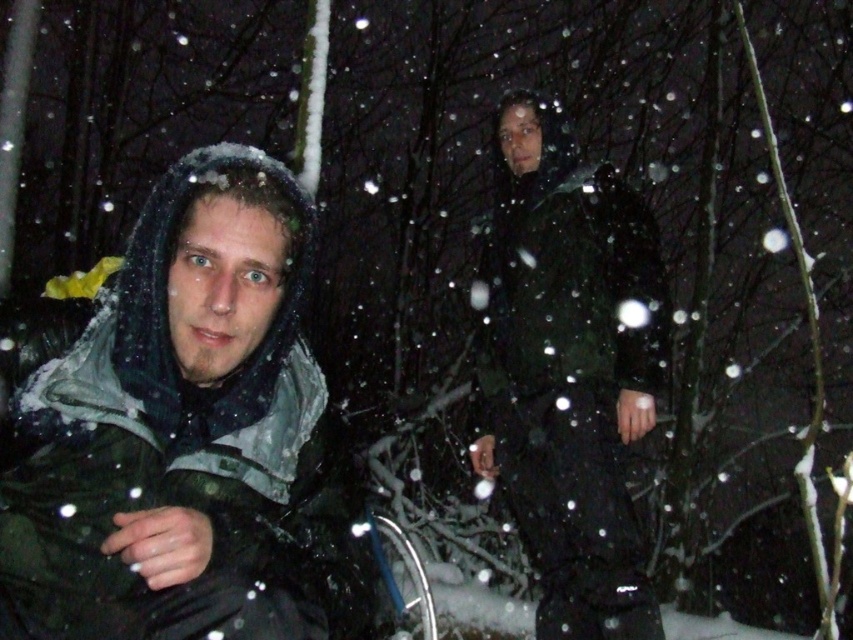
You are a photographer trying to capture the matte black jacket at left in the snowy forest scene. Where exactly should you focus your camera to ensure it is in sharp focus?

You should focus your camera at point (x=189, y=436) to ensure the matte black jacket at left is in sharp focus.

You are a photographer trying to capture a closeup of the snowflakes on the person in the foreground. You have two points marked in the image, point A at coordinates point (91, 605) and point B at coordinates point (541, 360). Which point should you focus on to ensure the snowflakes on the person in the foreground are in focus?

You should focus on point A at coordinates point (91, 605) because it is closer to the viewer than point B at coordinates point (541, 360), ensuring the snowflakes on the person in the foreground are in focus.

Consider the image. You are a photographer trying to capture a group photo of two people wearing the matte black jacket at left and dark green jacket at center. The camera you are using has a minimum focusing distance of 1.5 meters. Can you take a clear photo of both subjects without moving them?

The distance between the matte black jacket at left and dark green jacket at center is 1.72 meters, which is greater than the camera minimum focusing distance of 1.5 meters. Therefore, you can take a clear photo of both subjects without moving them.